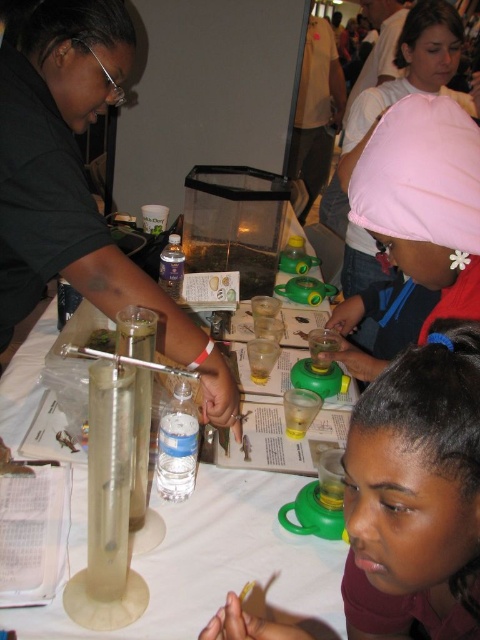
Question: Which point is farther to the camera?

Choices:
 (A) pink fabric cap at upper center
 (B) translucent plastic table at center

Answer: (B)

Question: Among these objects, which one is farthest from the camera?

Choices:
 (A) translucent plastic table at center
 (B) matte green plastic cup at center
 (C) pink fabric cap at upper center

Answer: (A)

Question: Estimate the real-world distances between objects in this image. Which object is farther from the translucent plastic table at center?

Choices:
 (A) matte green plastic cup at center
 (B) pink fabric cap at upper center

Answer: (B)

Question: Does translucent plastic table at center appear over pink fabric cap at upper center?

Choices:
 (A) no
 (B) yes

Answer: (A)

Question: Can you confirm if matte green plastic cup at center is positioned to the left of translucent plastic table at center?

Choices:
 (A) no
 (B) yes

Answer: (A)

Question: Can you confirm if matte green plastic cup at center is bigger than pink fabric cap at upper center?

Choices:
 (A) no
 (B) yes

Answer: (A)